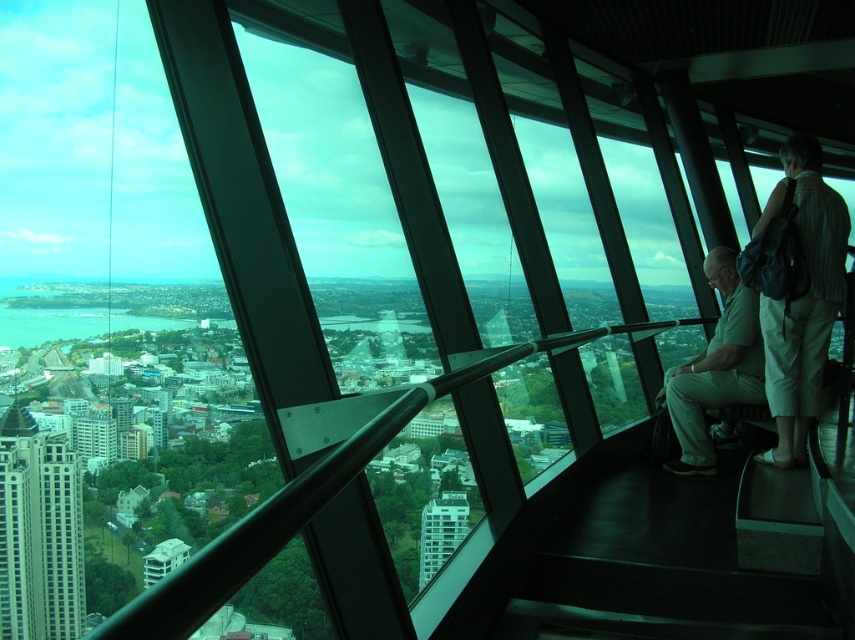
Question: Can you confirm if striped fabric shirt at right is positioned to the right of white glass building at center?

Choices:
 (A) no
 (B) yes

Answer: (B)

Question: Which point appears closest to the camera in this image?

Choices:
 (A) (770, 333)
 (B) (740, 381)
 (C) (453, 532)
 (D) (45, 444)

Answer: (A)

Question: Is striped fabric shirt at right to the left of white glass building at center from the viewer's perspective?

Choices:
 (A) yes
 (B) no

Answer: (B)

Question: Which object is the closest to the white glass building at center?

Choices:
 (A) light beige pants at center
 (B) striped fabric shirt at right

Answer: (A)

Question: Which object is closer to the camera taking this photo?

Choices:
 (A) white glass building at center
 (B) light beige pants at center

Answer: (B)

Question: Is striped fabric shirt at right smaller than white glass building at center?

Choices:
 (A) no
 (B) yes

Answer: (A)